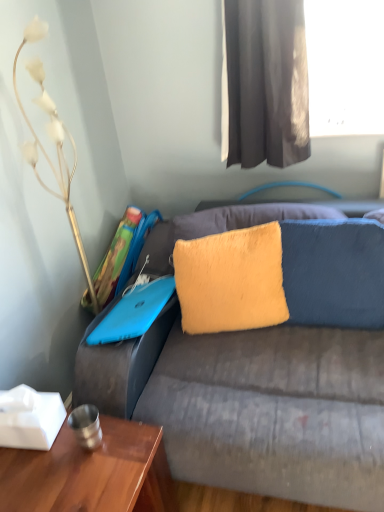
Question: In the image, is metallic gold decorative at left positioned in front of or behind yellow fuzzy pillow at center, placed as the 2th pillow when sorted from left to right?

Choices:
 (A) front
 (B) behind

Answer: (A)

Question: Considering the positions of metallic gold decorative at left and yellow fuzzy pillow at center, placed as the 2th pillow when sorted from left to right, in the image, is metallic gold decorative at left wider or thinner than yellow fuzzy pillow at center, placed as the 2th pillow when sorted from left to right,?

Choices:
 (A) wide
 (B) thin

Answer: (A)

Question: Which is farther from the wooden table at lower left?

Choices:
 (A) blue matte laptop at upper left
 (B) metallic gold decorative at left
 (C) yellow furry pillow at center, which ranks as the first pillow in left-to-right order
 (D) dark gray fabric curtain at upper center
 (E) yellow fuzzy pillow at center, placed as the 2th pillow when sorted from left to right

Answer: (D)

Question: Which is farther from the wooden table at lower left?

Choices:
 (A) yellow furry pillow at center, which ranks as the first pillow in left-to-right order
 (B) metallic gold decorative at left
 (C) blue matte laptop at upper left
 (D) dark gray fabric curtain at upper center
 (E) yellow fuzzy pillow at center, placed as the 2th pillow when sorted from left to right

Answer: (D)